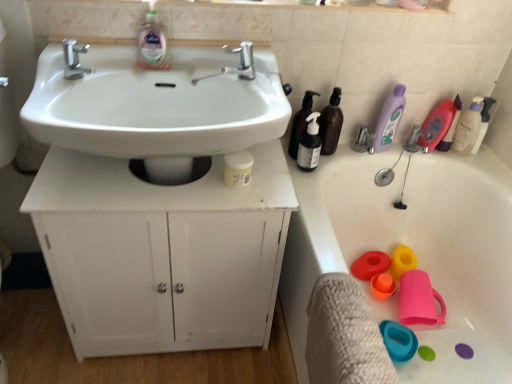
At what (x,y) coordinates should I click in order to perform the action: click on free point in front of white pump bottle at upper right, the 1th cleaning product in the right-to-left sequence. Please return your answer as a coordinate pair (x, y). This screenshot has width=512, height=384. Looking at the image, I should click on (480, 172).